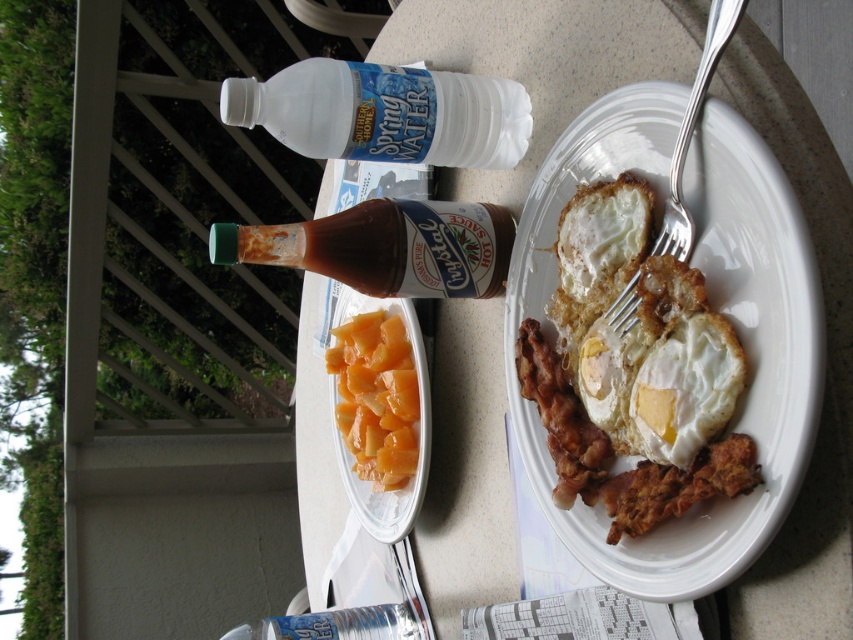
Question: Estimate the real-world distances between objects in this image. Which object is farther from the white plastic bottle at upper center?

Choices:
 (A) orange fleshed melon at plate left
 (B) golden fried eggs at plate right
 (C) silver metallic fork at plate right
 (D) white glossy egg at plate center

Answer: (D)

Question: Does orange fleshed melon at plate left have a greater width compared to silver metallic fork at plate right?

Choices:
 (A) no
 (B) yes

Answer: (B)

Question: Can you confirm if white plastic bottle at upper center is bigger than green glass bottle at center?

Choices:
 (A) yes
 (B) no

Answer: (B)

Question: Among these points, which one is nearest to the camera?

Choices:
 (A) 280,108
 (B) 416,246
 (C) 350,612

Answer: (A)

Question: In this image, where is golden fried eggs at plate right located relative to clear plastic bottle at upper center?

Choices:
 (A) below
 (B) above

Answer: (B)

Question: Among these points, which one is nearest to the camera?

Choices:
 (A) (787, 496)
 (B) (631, 252)
 (C) (604, 380)

Answer: (A)